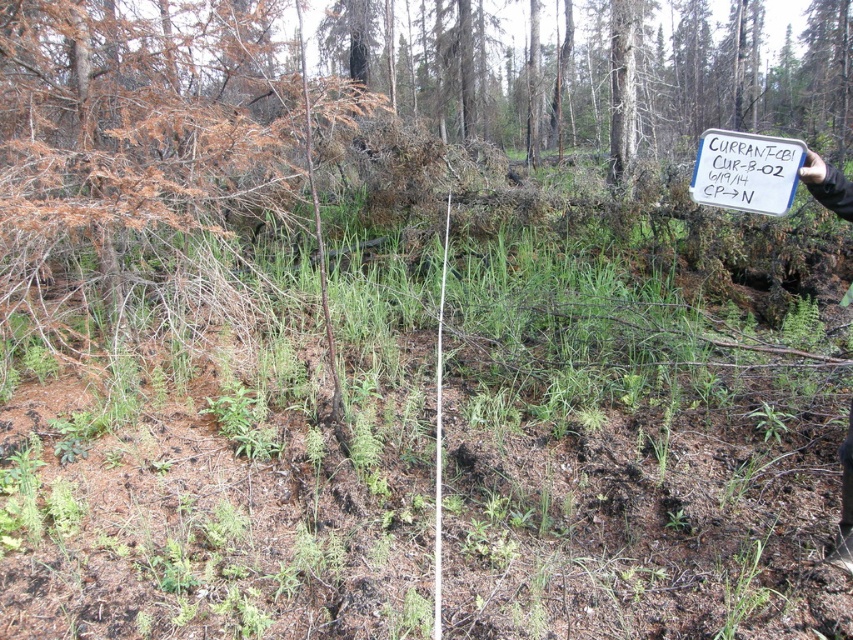
Question: Which of the following is the closest to the observer?

Choices:
 (A) white plastic sign at upper right
 (B) white paper sign at upper right

Answer: (B)

Question: Considering the relative positions of white paper sign at upper right and white plastic sign at upper right in the image provided, where is white paper sign at upper right located with respect to white plastic sign at upper right?

Choices:
 (A) above
 (B) below

Answer: (A)

Question: Which point is closer to the camera taking this photo?

Choices:
 (A) (821, 180)
 (B) (772, 141)

Answer: (A)

Question: Does white paper sign at upper right have a smaller size compared to white plastic sign at upper right?

Choices:
 (A) no
 (B) yes

Answer: (B)

Question: Can you confirm if white paper sign at upper right is positioned to the right of white plastic sign at upper right?

Choices:
 (A) no
 (B) yes

Answer: (A)